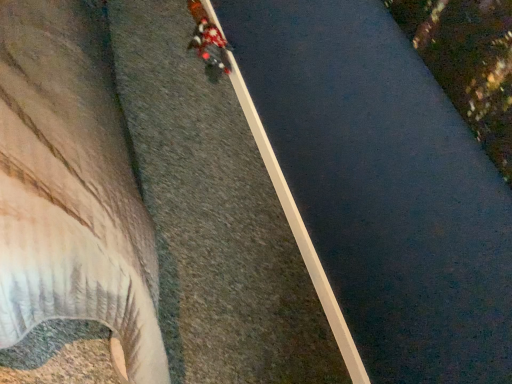
Find the location of `free space to the left of smooth concrete waterway at center`. free space to the left of smooth concrete waterway at center is located at coordinates (187, 105).